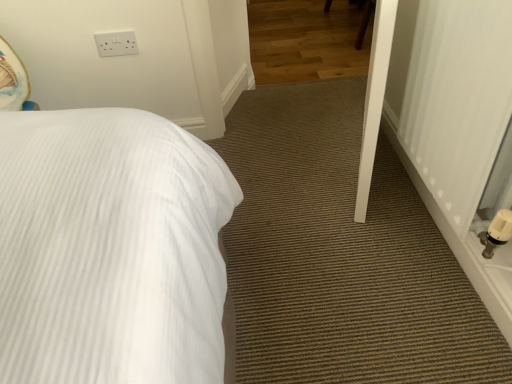
Question: Is white plastic radiator at right aimed at white plastic electric outlet at upper left?

Choices:
 (A) no
 (B) yes

Answer: (A)

Question: Would you consider white plastic radiator at right to be distant from white plastic electric outlet at upper left?

Choices:
 (A) yes
 (B) no

Answer: (A)

Question: Can we say white plastic radiator at right lies outside white plastic electric outlet at upper left?

Choices:
 (A) yes
 (B) no

Answer: (A)

Question: Does white plastic radiator at right have a lesser width compared to white plastic electric outlet at upper left?

Choices:
 (A) yes
 (B) no

Answer: (B)

Question: From a real-world perspective, is white plastic radiator at right under white plastic electric outlet at upper left?

Choices:
 (A) yes
 (B) no

Answer: (B)

Question: Is white plastic electric outlet at upper left completely or partially inside white plastic radiator at right?

Choices:
 (A) no
 (B) yes

Answer: (A)

Question: Considering the relative sizes of white plastic electric outlet at upper left and white plastic radiator at right in the image provided, is white plastic electric outlet at upper left shorter than white plastic radiator at right?

Choices:
 (A) yes
 (B) no

Answer: (A)

Question: Is white plastic electric outlet at upper left not within white plastic radiator at right?

Choices:
 (A) no
 (B) yes

Answer: (B)

Question: Is the position of white plastic electric outlet at upper left less distant than that of white plastic radiator at right?

Choices:
 (A) yes
 (B) no

Answer: (B)

Question: Is white plastic electric outlet at upper left positioned behind white plastic radiator at right?

Choices:
 (A) yes
 (B) no

Answer: (A)

Question: Is white plastic electric outlet at upper left far away from white plastic radiator at right?

Choices:
 (A) no
 (B) yes

Answer: (B)

Question: Is white plastic electric outlet at upper left turned away from white plastic radiator at right?

Choices:
 (A) no
 (B) yes

Answer: (A)

Question: From a real-world perspective, is white plastic radiator at right physically located above or below white plastic electric outlet at upper left?

Choices:
 (A) below
 (B) above

Answer: (B)